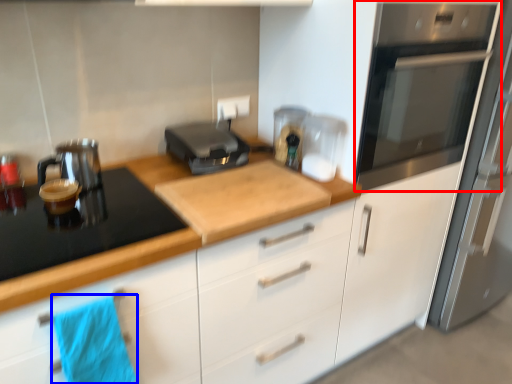
Question: Which object appears farthest to the camera in this image, home appliance (highlighted by a red box) or beach towel (highlighted by a blue box)?

Choices:
 (A) home appliance
 (B) beach towel

Answer: (A)